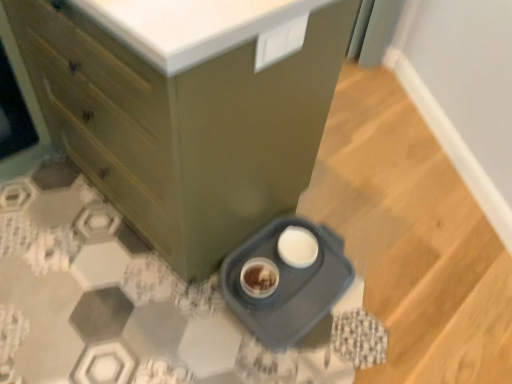
Question: Is matte green cabinet at lower left to the left or to the right of gray plastic tray at lower center in the image?

Choices:
 (A) left
 (B) right

Answer: (A)

Question: Is point (202, 66) closer or farther from the camera than point (314, 283)?

Choices:
 (A) closer
 (B) farther

Answer: (A)

Question: Considering their positions, is matte green cabinet at lower left located in front of or behind gray plastic tray at lower center?

Choices:
 (A) front
 (B) behind

Answer: (A)

Question: In the image, is gray plastic tray at lower center on the left side or the right side of matte green cabinet at lower left?

Choices:
 (A) right
 (B) left

Answer: (A)

Question: From the image's perspective, is gray plastic tray at lower center located above or below matte green cabinet at lower left?

Choices:
 (A) above
 (B) below

Answer: (B)

Question: Is point (310, 314) positioned closer to the camera than point (140, 74)?

Choices:
 (A) closer
 (B) farther

Answer: (B)

Question: Considering the positions of gray plastic tray at lower center and matte green cabinet at lower left in the image, is gray plastic tray at lower center bigger or smaller than matte green cabinet at lower left?

Choices:
 (A) small
 (B) big

Answer: (A)